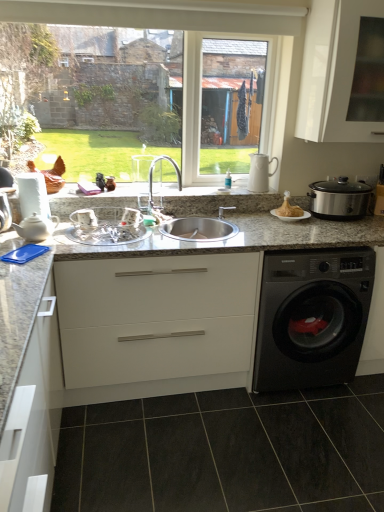
The width and height of the screenshot is (384, 512). What do you see at coordinates (339, 199) in the screenshot? I see `stainless steel slow cooker at right, the 1th appliance viewed from the right` at bounding box center [339, 199].

What is the approximate height of white matte cabinet at lower left, placed as the third cabinetry when sorted from right to left?

It is 3.29 feet.

This screenshot has width=384, height=512. In order to click on silver metallic faucet at center in this screenshot , I will do `click(152, 176)`.

What are the coordinates of `white glossy tea pot at left` in the screenshot? It's located at (36, 227).

What do you see at coordinates (164, 352) in the screenshot? The width and height of the screenshot is (384, 512). I see `granite/textured countertop at center` at bounding box center [164, 352].

This screenshot has height=512, width=384. What are the coordinates of `golden crispy turkey at center` in the screenshot? It's located at (289, 208).

Locate an element on the screen. This screenshot has width=384, height=512. stainless steel slow cooker at right, the 1th appliance viewed from the right is located at coordinates (339, 199).

You are a GUI agent. You are given a task and a screenshot of the screen. Output one action in this format:
    pyautogui.click(x=<x>, y=<y>)
    Task: Click on the cabinetry behind the black glossy washing machine at lower right
    The image size is (384, 512).
    Given the screenshot: What is the action you would take?
    pyautogui.click(x=333, y=72)

From the image's perspective, which is below, white glossy cabinet at upper right, positioned as the first cabinetry in right-to-left order, or black glossy washing machine at lower right?

black glossy washing machine at lower right, from the image's perspective.

Considering the positions of objects white glossy cabinet at upper right, positioned as the first cabinetry in right-to-left order, and black glossy washing machine at lower right in the image provided, who is in front, white glossy cabinet at upper right, positioned as the first cabinetry in right-to-left order, or black glossy washing machine at lower right?

black glossy washing machine at lower right is in front.

Is white matte cabinet at lower left, which is the first cabinetry from left to right, at the back of black glossy washing machine at lower right?

No.

In the image, is black glossy washing machine at lower right positioned in front of or behind white matte cabinet at lower left, which is the first cabinetry from left to right?

In the image, black glossy washing machine at lower right appears behind white matte cabinet at lower left, which is the first cabinetry from left to right.

Are black glossy washing machine at lower right and white matte cabinet at lower left, placed as the third cabinetry when sorted from right to left, beside each other?

No, black glossy washing machine at lower right is not beside white matte cabinet at lower left, placed as the third cabinetry when sorted from right to left.

Is black glossy washing machine at lower right smaller than white matte cabinet at lower left, which is the first cabinetry from left to right?

Indeed, black glossy washing machine at lower right has a smaller size compared to white matte cabinet at lower left, which is the first cabinetry from left to right.

How many degrees apart are the facing directions of white matte cabinet at lower left, placed as the third cabinetry when sorted from right to left, and white glossy cabinet at upper right, positioned as the first cabinetry in right-to-left order?

The angular difference between white matte cabinet at lower left, placed as the third cabinetry when sorted from right to left, and white glossy cabinet at upper right, positioned as the first cabinetry in right-to-left order, is 90.3 degrees.

Does white matte cabinet at lower left, placed as the third cabinetry when sorted from right to left, have a larger size compared to white glossy cabinet at upper right, positioned as the first cabinetry in right-to-left order?

Yes, white matte cabinet at lower left, placed as the third cabinetry when sorted from right to left, is bigger than white glossy cabinet at upper right, positioned as the first cabinetry in right-to-left order.

Is white matte cabinet at lower left, placed as the third cabinetry when sorted from right to left, wider or thinner than white glossy cabinet at upper right, the third cabinetry from the left?

Clearly, white matte cabinet at lower left, placed as the third cabinetry when sorted from right to left, has more width compared to white glossy cabinet at upper right, the third cabinetry from the left.

You are a GUI agent. You are given a task and a screenshot of the screen. Output one action in this format:
    pyautogui.click(x=<x>, y=<y>)
    Task: Click on the 1st cabinetry below the white glossy cabinet at upper right, the third cabinetry from the left (from a real-world perspective)
    
    Given the screenshot: What is the action you would take?
    pyautogui.click(x=34, y=417)

Is clear glass bowl at center, marked as the 3th appliance in a right-to-left arrangement, touching silver metallic faucet at center?

No, clear glass bowl at center, marked as the 3th appliance in a right-to-left arrangement, is not next to silver metallic faucet at center.

Consider the image. Which object is closer to the camera taking this photo, clear glass bowl at center, acting as the first appliance starting from the left, or silver metallic faucet at center?

clear glass bowl at center, acting as the first appliance starting from the left, is more forward.

This screenshot has height=512, width=384. Find the location of `the 2nd appliance below the silver metallic faucet at center (from a real-world perspective)`. the 2nd appliance below the silver metallic faucet at center (from a real-world perspective) is located at coordinates point(107,226).

From a real-world perspective, is clear glass bowl at center, marked as the 3th appliance in a right-to-left arrangement, on top of silver metallic faucet at center?

No.

From the image's perspective, is stainless steel slow cooker at right, placed as the third appliance when sorted from left to right, under golden crispy turkey at center?

Actually, stainless steel slow cooker at right, placed as the third appliance when sorted from left to right, appears above golden crispy turkey at center in the image.

Considering the relative sizes of stainless steel slow cooker at right, placed as the third appliance when sorted from left to right, and golden crispy turkey at center in the image provided, is stainless steel slow cooker at right, placed as the third appliance when sorted from left to right, smaller than golden crispy turkey at center?

No.

Based on the photo, from a real-world perspective, does stainless steel slow cooker at right, the 1th appliance viewed from the right, stand above golden crispy turkey at center?

Yes, from a real-world perspective, stainless steel slow cooker at right, the 1th appliance viewed from the right, is over golden crispy turkey at center

In the image, is clear glass window at upper center on the left side or the right side of silver metallic faucet at center?

clear glass window at upper center is positioned on silver metallic faucet at center's left side.

Considering the sizes of objects clear glass window at upper center and silver metallic faucet at center in the image provided, who is smaller, clear glass window at upper center or silver metallic faucet at center?

With smaller size is silver metallic faucet at center.

Is clear glass window at upper center spatially inside silver metallic faucet at center, or outside of it?

clear glass window at upper center exists outside the volume of silver metallic faucet at center.

What's the angular difference between clear glass window at upper center and silver metallic faucet at center's facing directions?

The facing directions of clear glass window at upper center and silver metallic faucet at center are 0.252 degrees apart.

What's the angular difference between silver metallic faucet at center and white glossy tea pot at left's facing directions?

They differ by 0.635 degrees in their facing directions.

How distant is silver metallic faucet at center from white glossy tea pot at left?

silver metallic faucet at center is 26.16 inches away from white glossy tea pot at left.

Does silver metallic faucet at center appear on the left side of white glossy tea pot at left?

In fact, silver metallic faucet at center is to the right of white glossy tea pot at left.

Considering the sizes of objects silver metallic faucet at center and white glossy tea pot at left in the image provided, who is wider, silver metallic faucet at center or white glossy tea pot at left?

With larger width is silver metallic faucet at center.

Find the location of a particular element. washing machine to the left of white glossy cabinet at upper right, positioned as the first cabinetry in right-to-left order is located at coordinates (312, 317).

Where is `washing machine that appears on the right of white matte cabinet at lower left, placed as the third cabinetry when sorted from right to left`? The height and width of the screenshot is (512, 384). washing machine that appears on the right of white matte cabinet at lower left, placed as the third cabinetry when sorted from right to left is located at coordinates (312, 317).

When comparing their distances from white matte cabinet at center, the second cabinetry from the right, does dark gray tile at lower center or clear glass window at upper center seem closer?

dark gray tile at lower center is closer to white matte cabinet at center, the second cabinetry from the right.

Considering their positions, is white ceramic pitcher at upper right, the second appliance in the left-to-right sequence, positioned closer to stainless steel slow cooker at right, the 1th appliance viewed from the right, than white glossy tea pot at left?

white ceramic pitcher at upper right, the second appliance in the left-to-right sequence, lies closer to stainless steel slow cooker at right, the 1th appliance viewed from the right, than the other object.

From the image, which object appears to be farther from golden crispy turkey at center, silver metallic faucet at center or granite/textured countertop at center?

granite/textured countertop at center lies further to golden crispy turkey at center than the other object.

Estimate the real-world distances between objects in this image. Which object is further from dark gray tile at lower center, black glossy washing machine at lower right or clear glass window at upper center?

clear glass window at upper center is positioned further to the anchor dark gray tile at lower center.

Looking at this image, based on their spatial positions, is white matte cabinet at center, acting as the 2th cabinetry starting from the left, or golden crispy turkey at center further from granite/textured countertop at center?

golden crispy turkey at center.

From the image, which object appears to be farther from granite/textured countertop at center, white glossy tea pot at left or dark gray tile at lower center?

white glossy tea pot at left.

From the image, which object appears to be farther from granite/textured countertop at center, golden crispy turkey at center or white matte cabinet at center, acting as the 2th cabinetry starting from the left?

golden crispy turkey at center.

Based on their spatial positions, is white glossy cabinet at upper right, positioned as the first cabinetry in right-to-left order, or white ceramic pitcher at upper right, the 2th appliance from the right, further from stainless steel slow cooker at right, the 1th appliance viewed from the right?

The object further to stainless steel slow cooker at right, the 1th appliance viewed from the right, is white glossy cabinet at upper right, positioned as the first cabinetry in right-to-left order.

Find the location of a particular element. The height and width of the screenshot is (512, 384). food between white ceramic pitcher at upper right, the 2th appliance from the right, and dark gray tile at lower center, in the vertical direction is located at coordinates (289, 208).

Where is `food between clear glass window at upper center and white glossy cabinet at upper right, the third cabinetry from the left, in the horizontal direction`? This screenshot has width=384, height=512. food between clear glass window at upper center and white glossy cabinet at upper right, the third cabinetry from the left, in the horizontal direction is located at coordinates (289, 208).

The image size is (384, 512). Identify the location of food between white matte cabinet at lower left, placed as the third cabinetry when sorted from right to left, and white glossy cabinet at upper right, the third cabinetry from the left. (289, 208).

The height and width of the screenshot is (512, 384). Find the location of `tap between clear glass window at upper center and white glossy tea pot at left from top to bottom`. tap between clear glass window at upper center and white glossy tea pot at left from top to bottom is located at coordinates (152, 176).